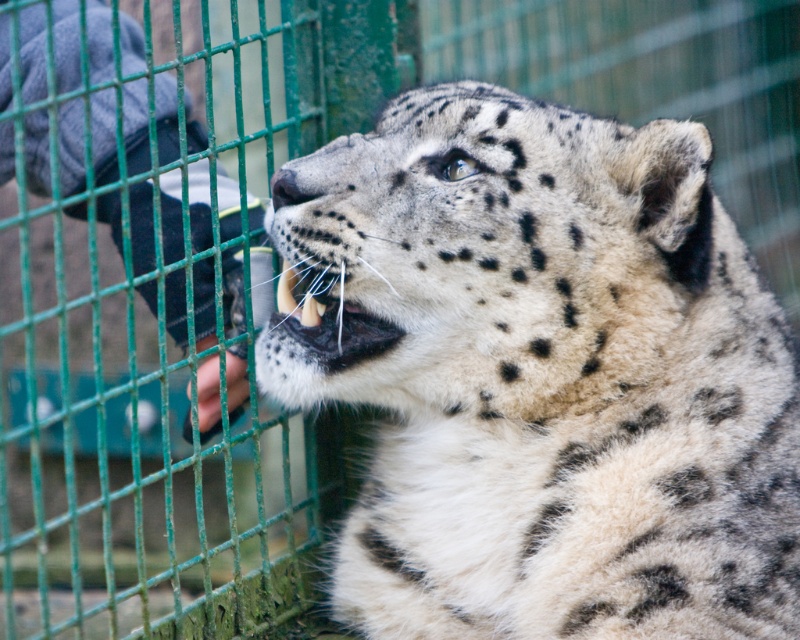
Is point (796, 627) more distant than point (298, 317)?

No, it is in front of (298, 317).

What do you see at coordinates (541, 376) in the screenshot? I see `spotted fur cheetah at center` at bounding box center [541, 376].

Where is `spotted fur cheetah at center`? This screenshot has width=800, height=640. spotted fur cheetah at center is located at coordinates (541, 376).

Who is more forward, (20,168) or (333,324)?

Point (20,168) is in front.

Is point (200, 205) closer to camera compared to point (293, 273)?

That is False.

You are a GUI agent. You are given a task and a screenshot of the screen. Output one action in this format:
    pyautogui.click(x=<x>, y=<y>)
    Task: Click on the denim glove at left
    This screenshot has width=800, height=640.
    Given the screenshot: What is the action you would take?
    (x=134, y=170)

Locate an element on the screen. denim glove at left is located at coordinates (134, 170).

Who is higher up, spotted fur cheetah at center or denim glove at left?

denim glove at left

From the picture: Does spotted fur cheetah at center come in front of denim glove at left?

Yes, it is in front of denim glove at left.

Is point (438, 470) less distant than point (66, 152)?

Yes, point (438, 470) is closer to viewer.

In order to click on spotted fur cheetah at center in this screenshot , I will do `click(541, 376)`.